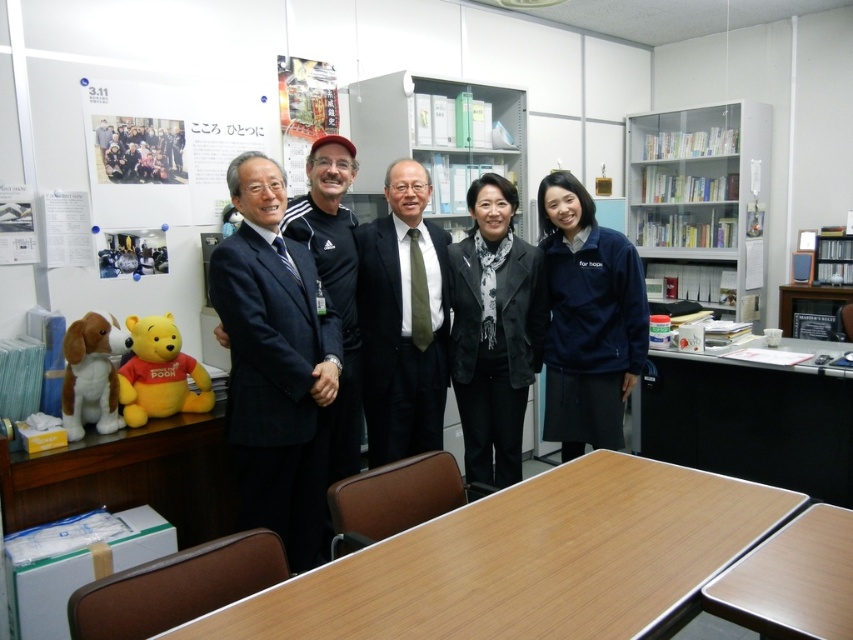
Question: Which point is closer to the camera taking this photo?

Choices:
 (A) (296, 531)
 (B) (508, 340)

Answer: (A)

Question: Which of the following is the closest to the observer?

Choices:
 (A) brown laminate table at lower right
 (B) wooden table at lower right
 (C) black adidas tracksuit at center
 (D) metallic gray bookshelf at upper center

Answer: (A)

Question: Is wooden table at center to the right of wooden table at lower right from the viewer's perspective?

Choices:
 (A) yes
 (B) no

Answer: (B)

Question: Considering the relative positions of white glass bookshelf at upper right and dark green textured tie at center in the image provided, where is white glass bookshelf at upper right located with respect to dark green textured tie at center?

Choices:
 (A) below
 (B) above

Answer: (B)

Question: Is wooden table at center thinner than navy blue fleece jacket at center?

Choices:
 (A) yes
 (B) no

Answer: (B)

Question: Which object is positioned closest to the black adidas tracksuit at center?

Choices:
 (A) wooden table at lower right
 (B) metallic gray bookshelf at upper center
 (C) dark blue suit at center
 (D) wooden table at center

Answer: (C)